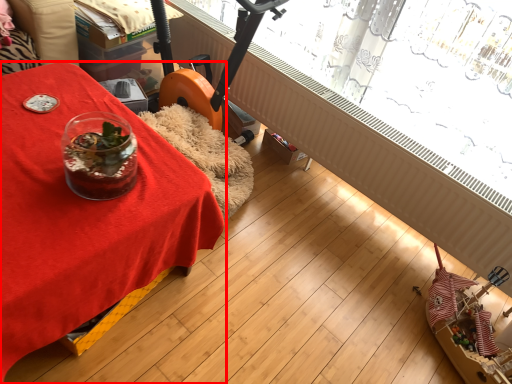
Question: Where is table (annotated by the red box) located in relation to bay window in the image?

Choices:
 (A) left
 (B) right

Answer: (A)